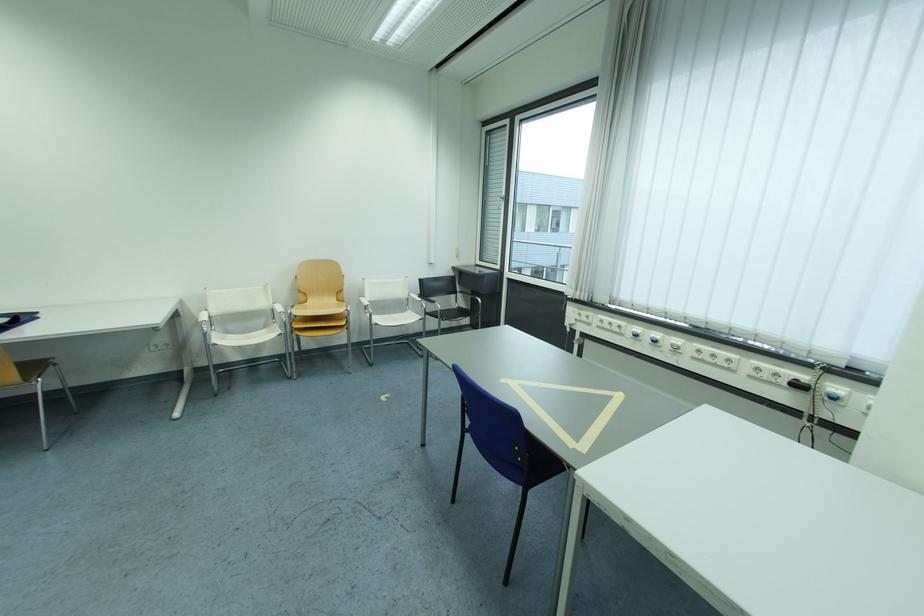
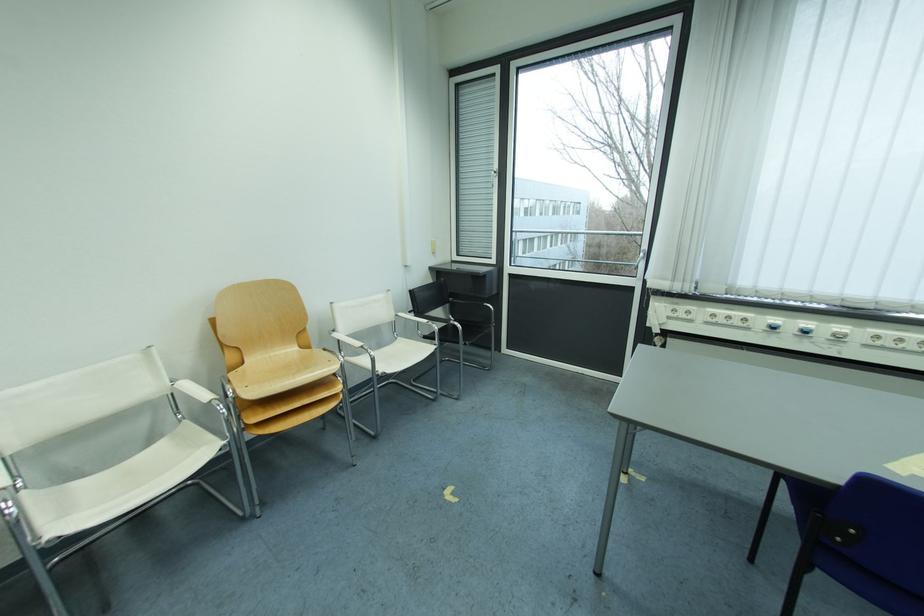
Where in the second image is the point corresponding to (686,342) from the first image?

(849, 330)